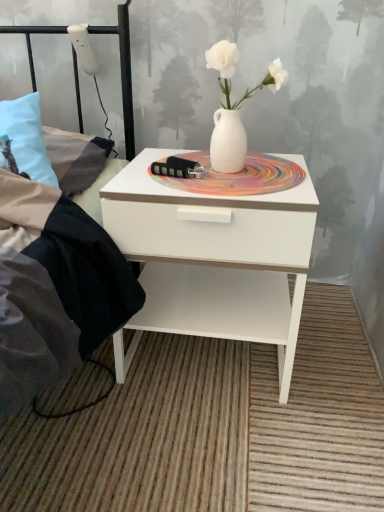
The width and height of the screenshot is (384, 512). I want to click on vacant space to the right of white glossy nightstand at center, so click(332, 361).